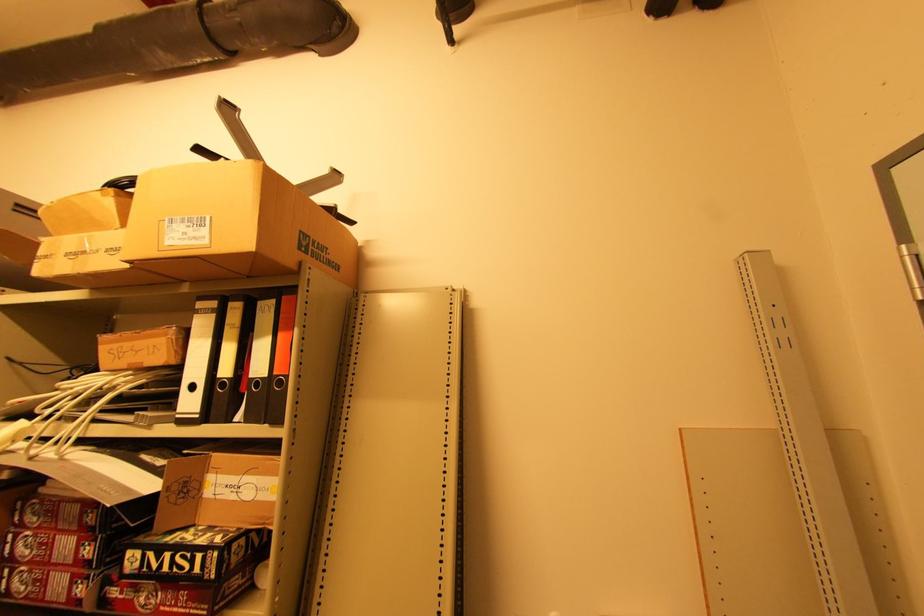
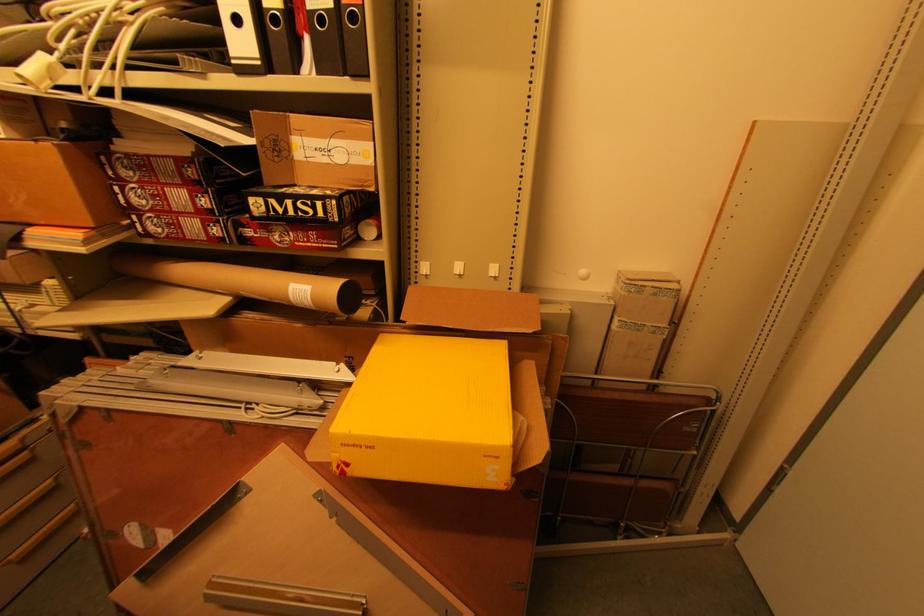
Question: How did the camera likely rotate?

Choices:
 (A) Left
 (B) Right
 (C) Up
 (D) Down

Answer: (D)